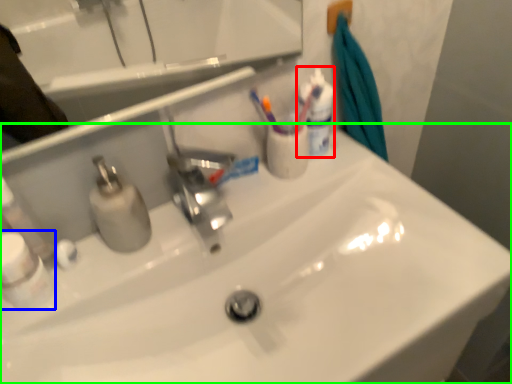
Question: Based on their relative distances, which object is farther from mouthwash (highlighted by a red box)? Choose from mouthwash (highlighted by a blue box) and sink (highlighted by a green box).

Choices:
 (A) mouthwash
 (B) sink

Answer: (A)